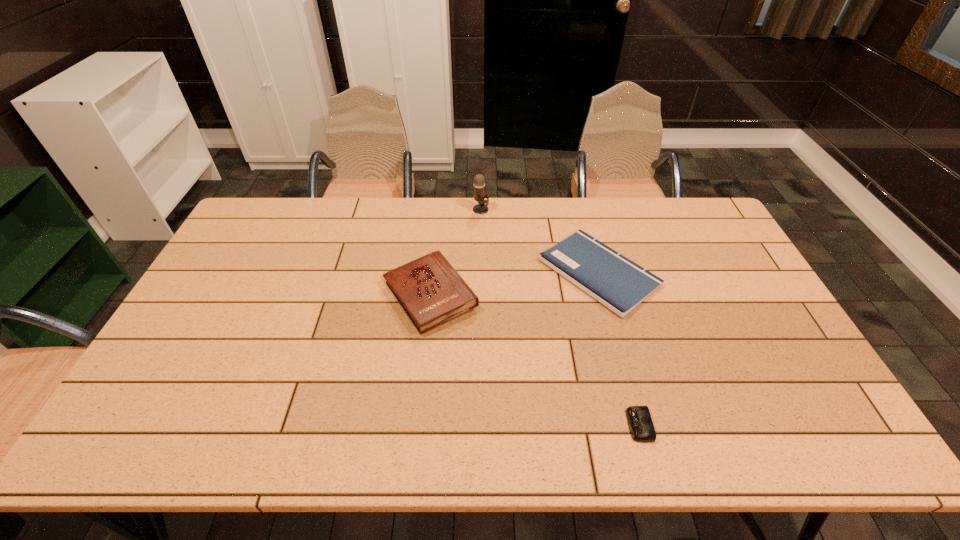
Where is `free spot between the third tallest object and the nearest object`? The height and width of the screenshot is (540, 960). free spot between the third tallest object and the nearest object is located at coordinates (x=619, y=349).

You are a GUI agent. You are given a task and a screenshot of the screen. Output one action in this format:
    pyautogui.click(x=<x>, y=<y>)
    Task: Click on the free spot between the second shortest object and the nearest object
    Image resolution: width=960 pixels, height=540 pixels.
    Given the screenshot: What is the action you would take?
    pyautogui.click(x=619, y=349)

What are the coordinates of `blank region between the third shortest object and the microphone` in the screenshot? It's located at (456, 253).

Find the location of a particular element. free spot between the nearest object and the second shortest object is located at coordinates (619, 349).

Where is `vacant space that is in between the second shortest object and the microphone`? The width and height of the screenshot is (960, 540). vacant space that is in between the second shortest object and the microphone is located at coordinates (540, 241).

Locate an element on the screen. This screenshot has width=960, height=540. vacant region between the farthest object and the paperback book is located at coordinates (540, 241).

I want to click on free point between the hardback book and the alarm clock, so click(535, 360).

Locate an element on the screen. free space between the third shortest object and the farthest object is located at coordinates (456, 253).

Where is `vacant space in between the third shortest object and the paperback book`? The image size is (960, 540). vacant space in between the third shortest object and the paperback book is located at coordinates (515, 284).

Locate an element on the screen. This screenshot has width=960, height=540. vacant area that lies between the hardback book and the shortest object is located at coordinates (535, 360).